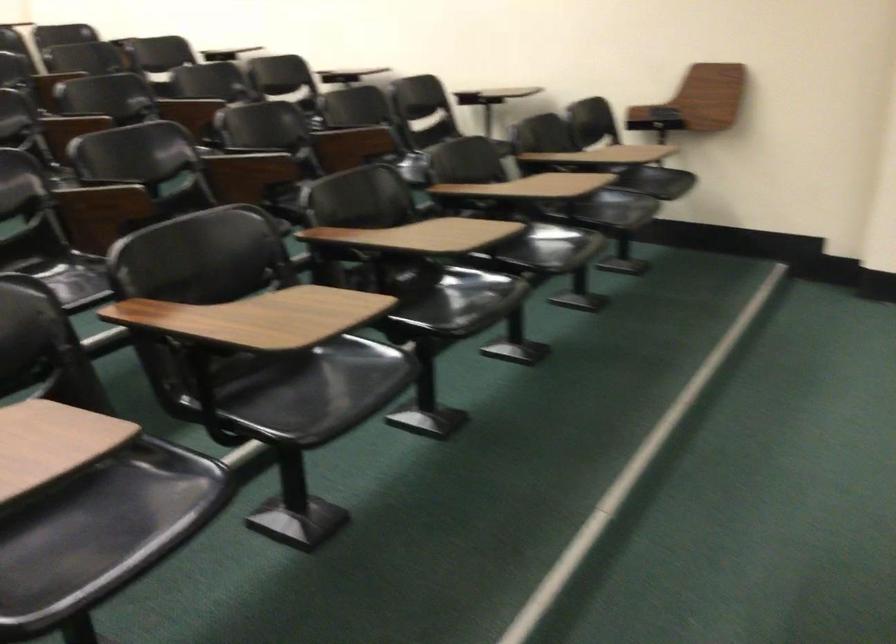
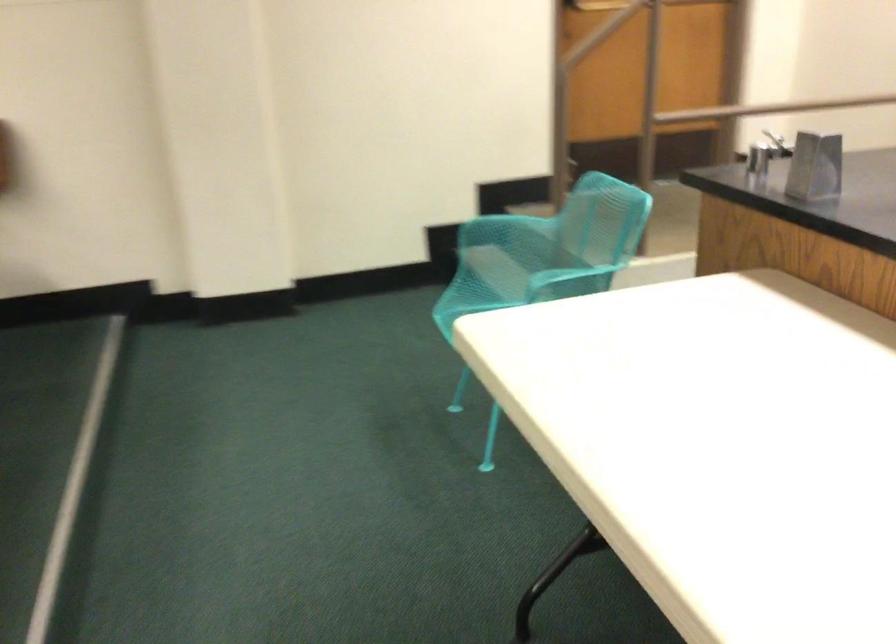
Question: The camera is either moving clockwise (left) or counter-clockwise (right) around the object. The first image is from the beginning of the video and the second image is from the end. Is the camera moving left or right when shooting the video?

Choices:
 (A) Left
 (B) Right

Answer: (A)